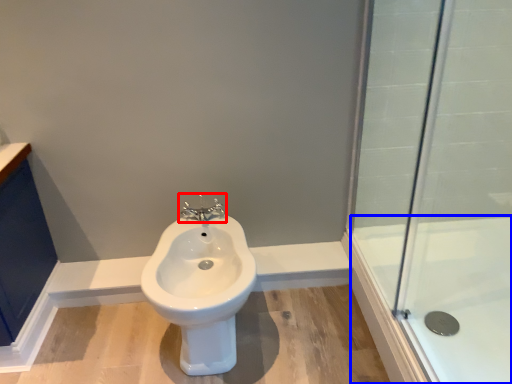
Question: Which of the following is the closest to the observer, tap (highlighted by a red box) or bath (highlighted by a blue box)?

Choices:
 (A) tap
 (B) bath

Answer: (B)